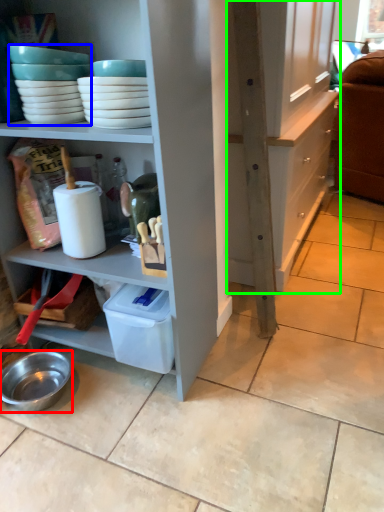
Question: Estimate the real-world distances between objects in this image. Which object is closer to bowl (highlighted by a red box), tableware (highlighted by a blue box) or cabinetry (highlighted by a green box)?

Choices:
 (A) tableware
 (B) cabinetry

Answer: (A)